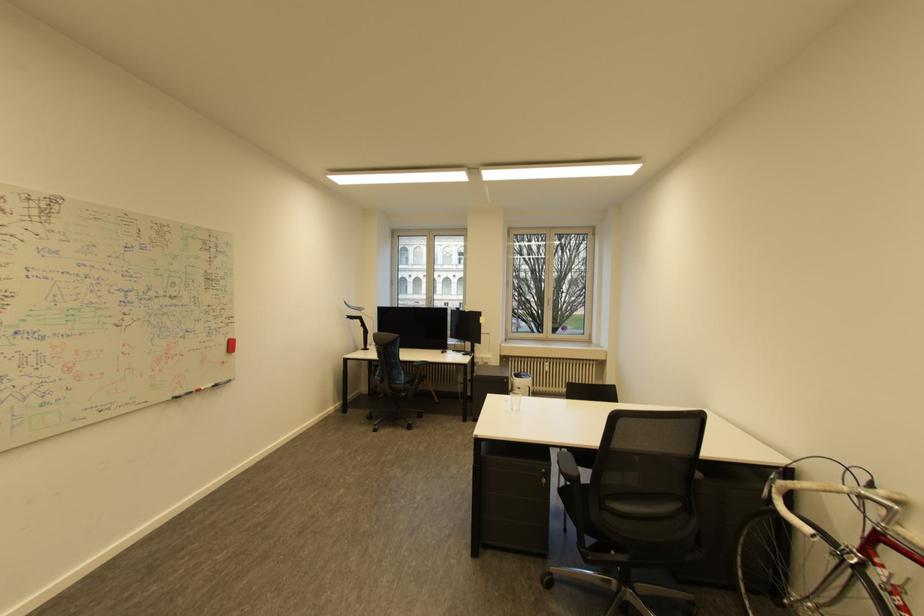
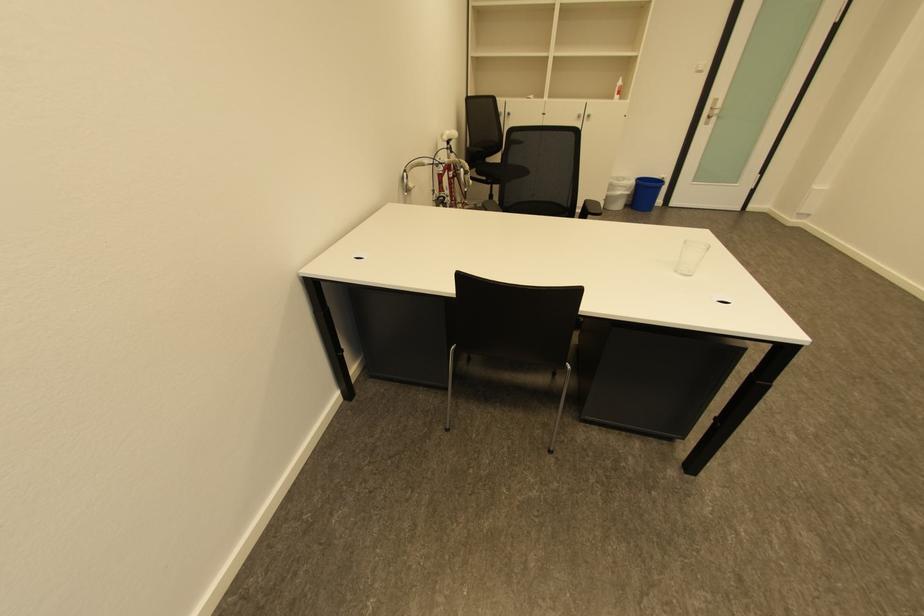
Question: I am providing you with two images of the same scene from different viewpoints. Which of the following objects are not visible in image2?

Choices:
 (A) cabinet drawer handle
 (B) clear drinking glass
 (C) blue trash can
 (D) white plant bowl

Answer: (A)